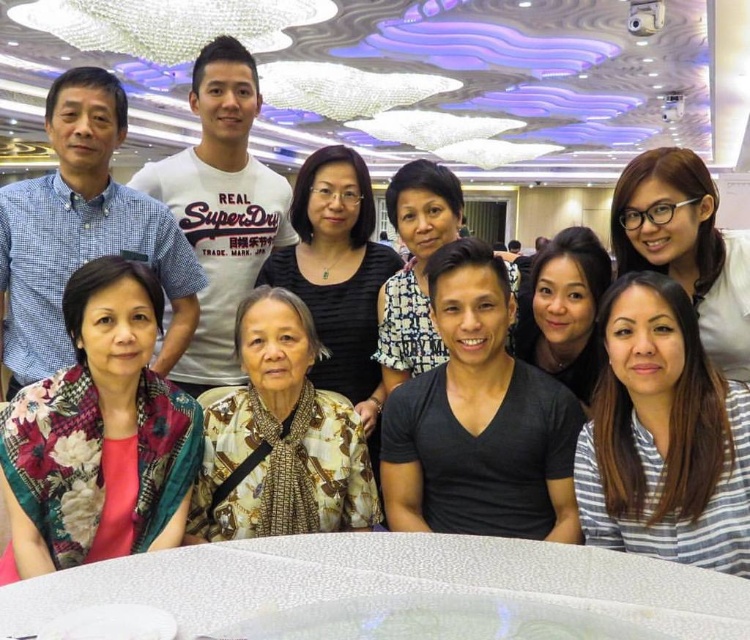
You are a photographer trying to capture a detailed shot of the printed fabric blouse at center and the patterned fabric scarf at center. Which item has a smaller width?

The printed fabric blouse at center has a smaller width than the patterned fabric scarf at center.

Based on the scene description, which object is positioned lower between the printed fabric blouse at center and the patterned fabric scarf at center?

The printed fabric blouse at center is located below the patterned fabric scarf at center, so it is positioned lower.